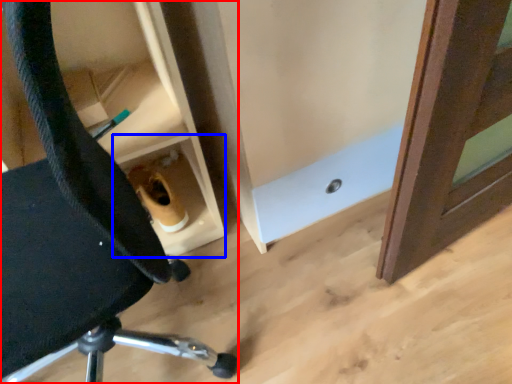
Question: Which point is further to the camera, chair (highlighted by a red box) or cabinetry (highlighted by a blue box)?

Choices:
 (A) chair
 (B) cabinetry

Answer: (B)